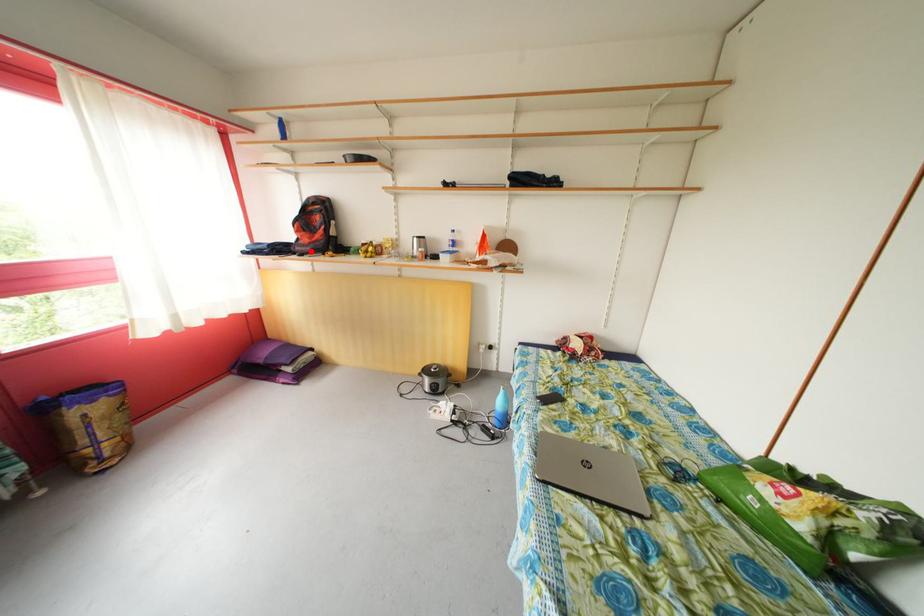
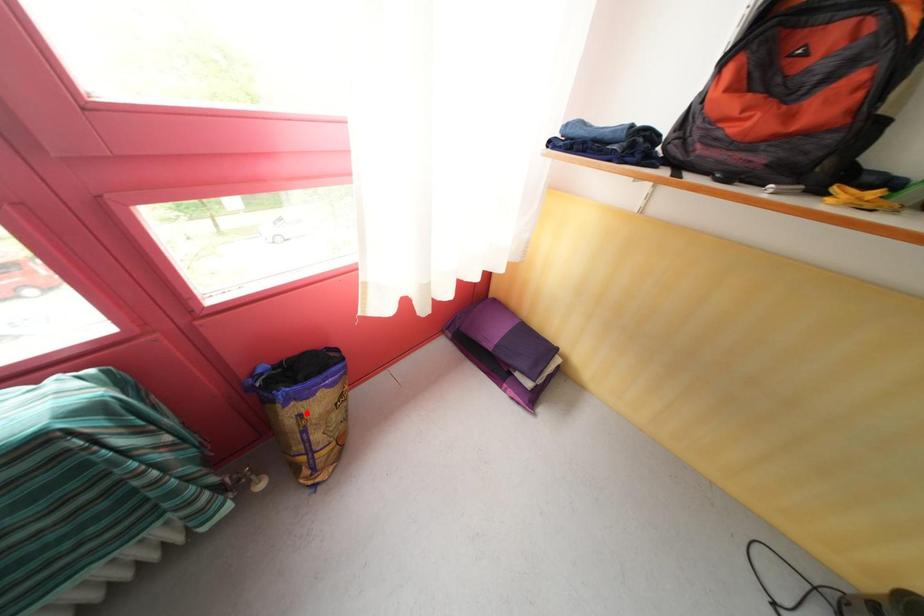
In the scene shown: I am providing you with two images of the same scene from different viewpoints. A red point is marked on the first image and another point is marked on the second image. Are the points marked in image1 and image2 representing the same 3D position?

No